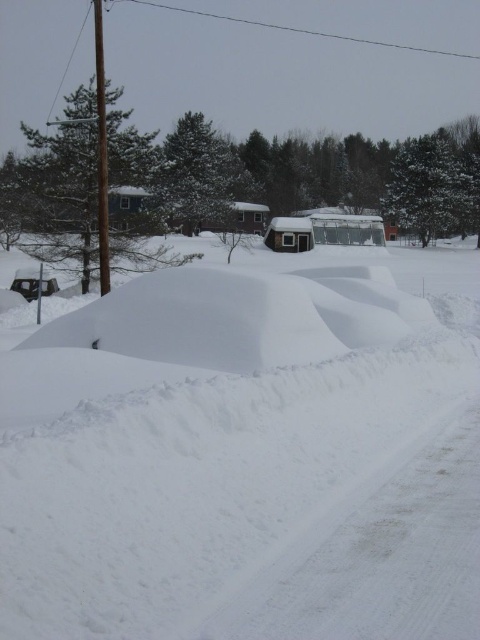
You are planning to park your new shiny black car at left in the snowy area. Considering the white fluffy snow at center is wider than the car, will there be enough space to park the car without touching the snow on either side?

The white fluffy snow at center is wider than the shiny black car at left, so there is sufficient space to park the car without touching the snow on either side.

You are standing at the edge of the cleared path in the snowy scene. You see the white fluffy snow at center and the shiny black car at left. Which object is nearer to you?

The white fluffy snow at center is closer to the viewer than the shiny black car at left, so the white fluffy snow at center is nearer to you.